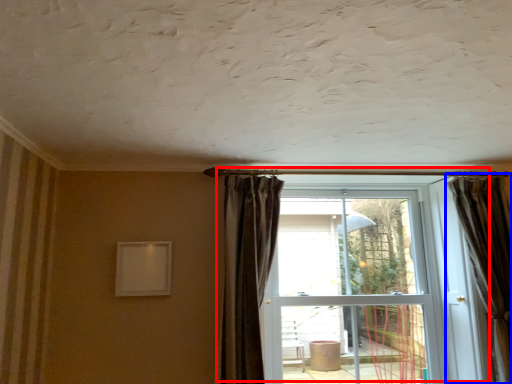
Question: Which of the following is the closest to the observer, door (highlighted by a red box) or curtain (highlighted by a blue box)?

Choices:
 (A) door
 (B) curtain

Answer: (B)